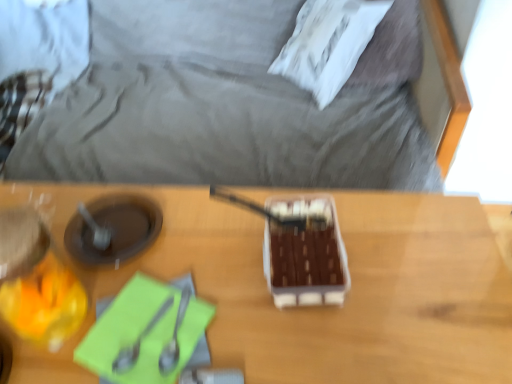
At what (x,y) coordinates should I click in order to perform the action: click on vacant area situated to the left side of satin silver spoon at center, marked as the 1th utensil in a right-to-left arrangement. Please return your answer as a coordinate pair (x, y). This screenshot has height=384, width=512. Looking at the image, I should click on (91, 327).